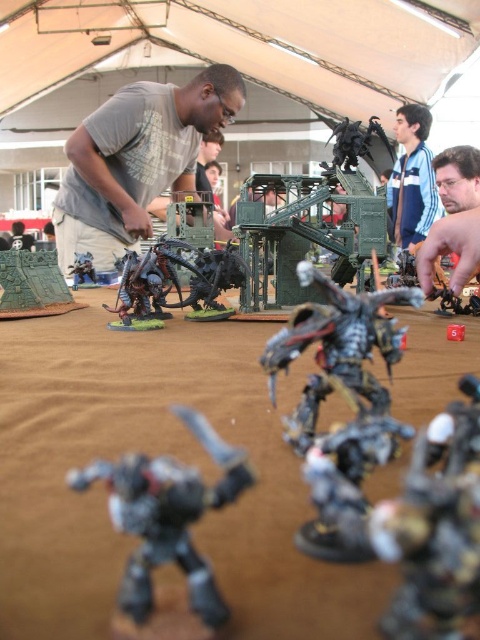
Between gray matte shirt at center and matte gray helmet at upper right, which one has more height?

gray matte shirt at center

Which is below, gray matte shirt at center or matte gray helmet at upper right?

Positioned lower is matte gray helmet at upper right.

Which is behind, point (146, 189) or point (465, 188)?

Point (146, 189)

This screenshot has width=480, height=640. I want to click on gray matte shirt at center, so click(135, 161).

Is shiny metallic robot at center thinner than matte gray helmet at upper right?

Correct, shiny metallic robot at center's width is less than matte gray helmet at upper right's.

Who is taller, shiny metallic robot at center or matte gray helmet at upper right?

matte gray helmet at upper right

The image size is (480, 640). Describe the element at coordinates (336, 349) in the screenshot. I see `shiny metallic robot at center` at that location.

In order to click on shiny metallic robot at center in this screenshot , I will do `click(336, 349)`.

Between blue striped shirt at upper center and matte gray helmet at upper right, which one has less height?

matte gray helmet at upper right

Is blue striped shirt at upper center closer to camera compared to matte gray helmet at upper right?

No, blue striped shirt at upper center is further to the viewer.

Who is more distant from viewer, (393, 230) or (456, 148)?

Positioned behind is point (393, 230).

I want to click on blue striped shirt at upper center, so click(412, 179).